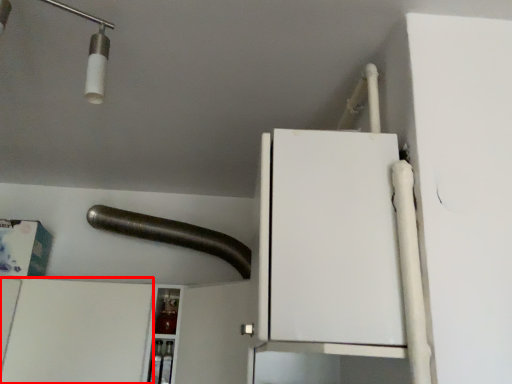
Question: In this image, where is cabinetry (annotated by the red box) located relative to beam?

Choices:
 (A) left
 (B) right

Answer: (A)